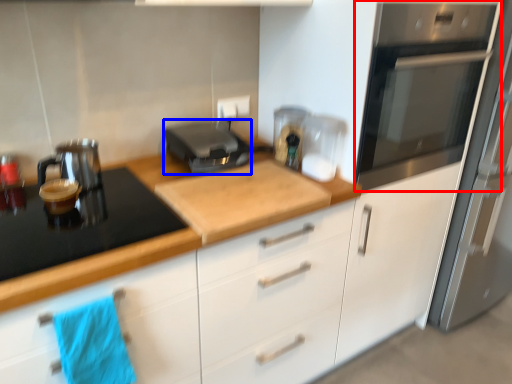
Question: Which point is closer to the camera, home appliance (highlighted by a red box) or kitchen appliance (highlighted by a blue box)?

Choices:
 (A) home appliance
 (B) kitchen appliance

Answer: (A)